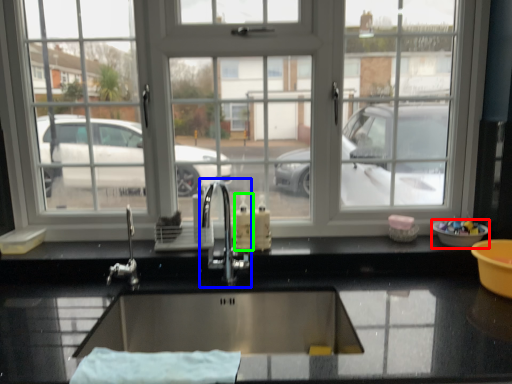
Question: Which object is the closest to the basin (highlighted by a red box)? Choose among these: tap (highlighted by a blue box) or soap dispenser (highlighted by a green box).

Choices:
 (A) tap
 (B) soap dispenser

Answer: (B)